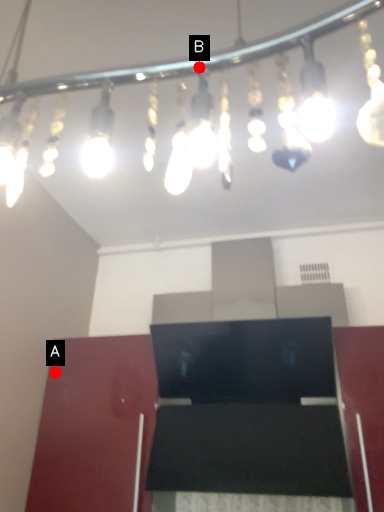
Question: Two points are circled on the image, labeled by A and B beside each circle. Which of the following is the closest to the observer?

Choices:
 (A) A is closer
 (B) B is closer

Answer: (B)